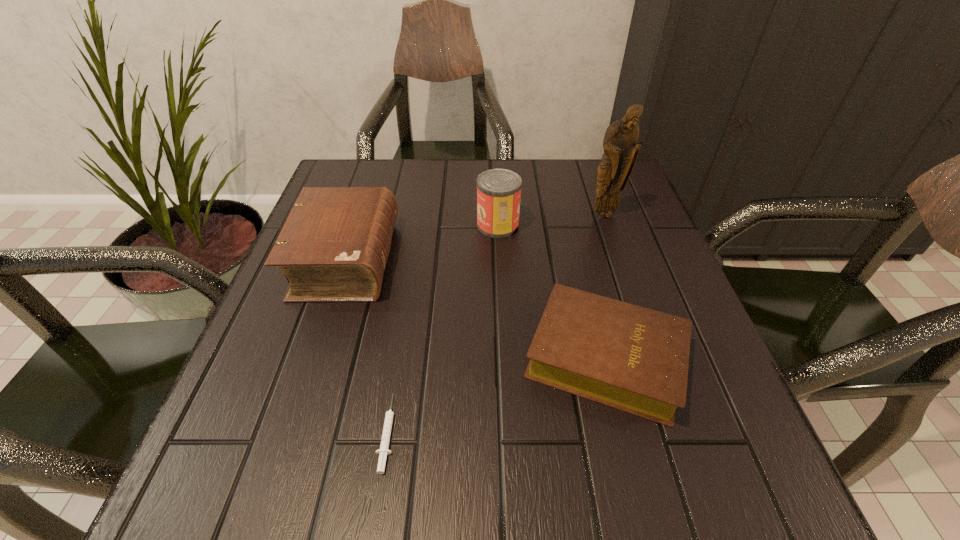
Identify the location of the tallest object. (621, 150).

What are the coordinates of `can` in the screenshot? It's located at (498, 190).

The image size is (960, 540). I want to click on the taller Bible, so click(334, 246).

The image size is (960, 540). In order to click on the farther Bible in this screenshot , I will do coord(334,246).

Image resolution: width=960 pixels, height=540 pixels. What are the coordinates of `the nearer Bible` in the screenshot? It's located at (631, 358).

You are a GUI agent. You are given a task and a screenshot of the screen. Output one action in this format:
    pyautogui.click(x=<x>, y=<y>)
    Task: Click on the right Bible
    Image resolution: width=960 pixels, height=540 pixels.
    Given the screenshot: What is the action you would take?
    pyautogui.click(x=631, y=358)

Where is `the second object from left to right`? This screenshot has width=960, height=540. the second object from left to right is located at coordinates (384, 446).

Where is `the shortest object`? The image size is (960, 540). the shortest object is located at coordinates coord(384,446).

This screenshot has width=960, height=540. I want to click on vacant space situated 0.300m on the front-facing side of the figurine, so click(639, 317).

Find the location of a particular element. The image size is (960, 540). blank space located on the right of the can is located at coordinates 644,225.